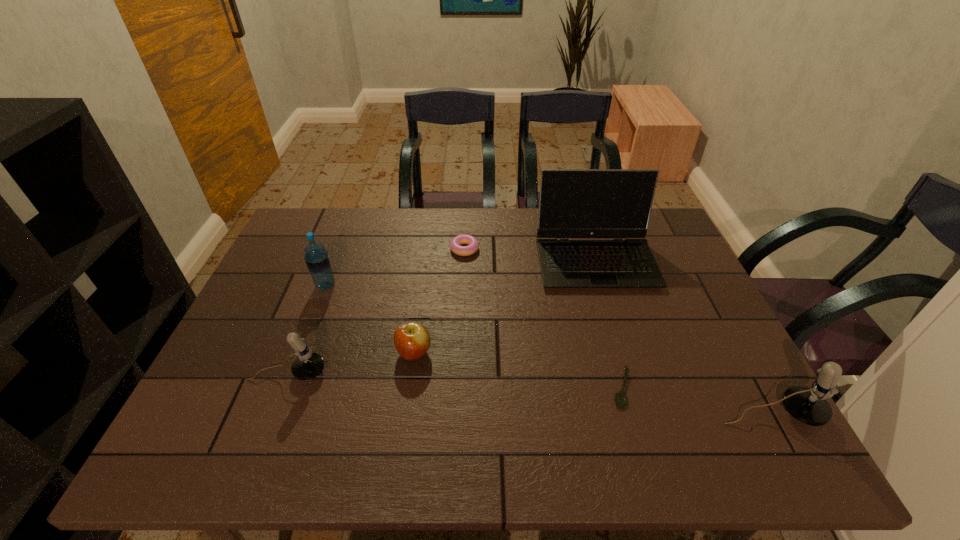
At what (x,y) coordinates should I click in order to perform the action: click on the shortest object. Please return your answer as a coordinate pair (x, y). Looking at the image, I should click on (621, 399).

The height and width of the screenshot is (540, 960). In order to click on vacant area located 0.120m on the right of the left microphone in this screenshot , I will do `click(376, 372)`.

At what (x,y) coordinates should I click in order to perform the action: click on free spot located 0.190m on the left of the taller microphone. Please return your answer as a coordinate pair (x, y). Image resolution: width=960 pixels, height=540 pixels. Looking at the image, I should click on (632, 413).

Locate an element on the screen. vacant space located on the front of the second shortest object is located at coordinates (460, 357).

Where is `free spot located on the back of the water bottle`? The width and height of the screenshot is (960, 540). free spot located on the back of the water bottle is located at coordinates (337, 256).

Locate an element on the screen. The height and width of the screenshot is (540, 960). free space located 0.380m on the screen of the laptop computer is located at coordinates (640, 410).

Identify the location of vacant space located on the right of the fifth object from right to left. (549, 353).

Where is `free spot located 0.080m on the back of the soupspoon`? This screenshot has width=960, height=540. free spot located 0.080m on the back of the soupspoon is located at coordinates (610, 344).

Where is `doughnut that is at the far edge`? This screenshot has width=960, height=540. doughnut that is at the far edge is located at coordinates (455, 244).

The image size is (960, 540). In order to click on laptop computer that is at the far edge in this screenshot , I will do `click(574, 203)`.